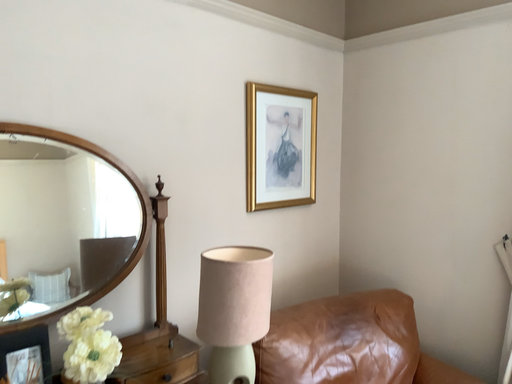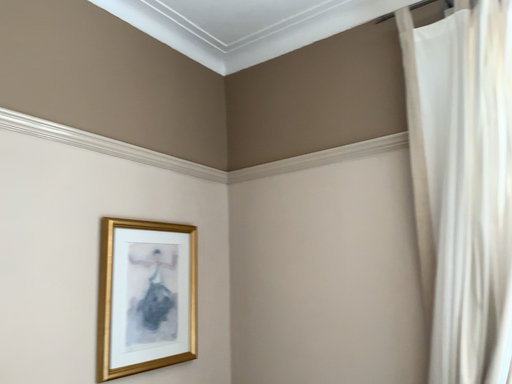
Question: How did the camera likely rotate when shooting the video?

Choices:
 (A) rotated upward
 (B) rotated downward

Answer: (A)